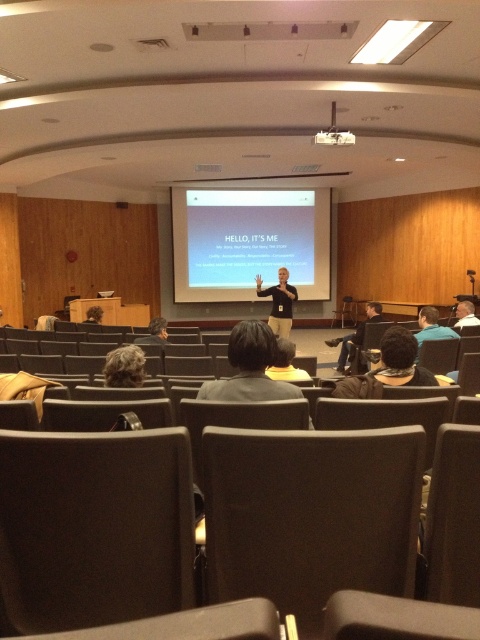
Question: Is dark brown fabric chair at center to the left of dark brown hair at lower left from the viewer's perspective?

Choices:
 (A) no
 (B) yes

Answer: (A)

Question: Based on their relative distances, which object is farther from the dark brown hair at lower left?

Choices:
 (A) dark brown fabric chair at center
 (B) blonde hair at lower left

Answer: (A)

Question: Is black shirt at center above dark blue jeans at center?

Choices:
 (A) no
 (B) yes

Answer: (B)

Question: Among these points, which one is farthest from the camera?

Choices:
 (A) (286, 240)
 (B) (133, 371)
 (C) (337, 145)

Answer: (A)

Question: Is blonde hair at lower left further to the viewer compared to black shirt at center?

Choices:
 (A) no
 (B) yes

Answer: (A)

Question: Which point appears closest to the camera in this image?

Choices:
 (A) (190, 582)
 (B) (256, 294)

Answer: (A)